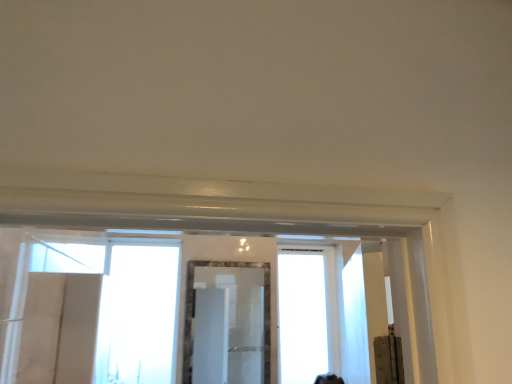
Question: Is marble frame mirror at center positioned before transparent glass window at center, which is counted as the 1th window, starting from the left?

Choices:
 (A) yes
 (B) no

Answer: (A)

Question: Is marble frame mirror at center oriented towards transparent glass window at center, positioned as the 2th window in right-to-left order?

Choices:
 (A) yes
 (B) no

Answer: (B)

Question: Is marble frame mirror at center behind transparent glass window at center, positioned as the 2th window in right-to-left order?

Choices:
 (A) no
 (B) yes

Answer: (A)

Question: Is marble frame mirror at center beside transparent glass window at center, which is counted as the 1th window, starting from the left?

Choices:
 (A) no
 (B) yes

Answer: (A)

Question: From a real-world perspective, is marble frame mirror at center on top of transparent glass window at center, positioned as the 2th window in right-to-left order?

Choices:
 (A) yes
 (B) no

Answer: (B)

Question: From a real-world perspective, is transparent glass window at center, the first window positioned from the right, positioned above or below marble frame mirror at center?

Choices:
 (A) below
 (B) above

Answer: (B)

Question: Is transparent glass window at center, the first window positioned from the right, wider or thinner than marble frame mirror at center?

Choices:
 (A) thin
 (B) wide

Answer: (B)

Question: Considering their positions, is transparent glass window at center, the first window positioned from the right, located in front of or behind marble frame mirror at center?

Choices:
 (A) front
 (B) behind

Answer: (B)

Question: Considering the positions of transparent glass window at center, which ranks as the second window in left-to-right order, and marble frame mirror at center in the image, is transparent glass window at center, which ranks as the second window in left-to-right order, bigger or smaller than marble frame mirror at center?

Choices:
 (A) big
 (B) small

Answer: (A)

Question: Based on their sizes in the image, would you say transparent glass window at center, which is counted as the 1th window, starting from the left, is bigger or smaller than marble frame mirror at center?

Choices:
 (A) big
 (B) small

Answer: (A)

Question: In terms of width, does transparent glass window at center, positioned as the 2th window in right-to-left order, look wider or thinner when compared to marble frame mirror at center?

Choices:
 (A) wide
 (B) thin

Answer: (A)

Question: Considering the positions of transparent glass window at center, which is counted as the 1th window, starting from the left, and marble frame mirror at center in the image, is transparent glass window at center, which is counted as the 1th window, starting from the left, taller or shorter than marble frame mirror at center?

Choices:
 (A) short
 (B) tall

Answer: (B)

Question: Would you say transparent glass window at center, positioned as the 2th window in right-to-left order, is inside or outside marble frame mirror at center?

Choices:
 (A) outside
 (B) inside

Answer: (A)

Question: From a real-world perspective, is transparent glass window at center, the first window positioned from the right, physically located above or below transparent glass window at center, positioned as the 2th window in right-to-left order?

Choices:
 (A) above
 (B) below

Answer: (B)

Question: In terms of size, does transparent glass window at center, the first window positioned from the right, appear bigger or smaller than transparent glass window at center, which is counted as the 1th window, starting from the left?

Choices:
 (A) small
 (B) big

Answer: (B)